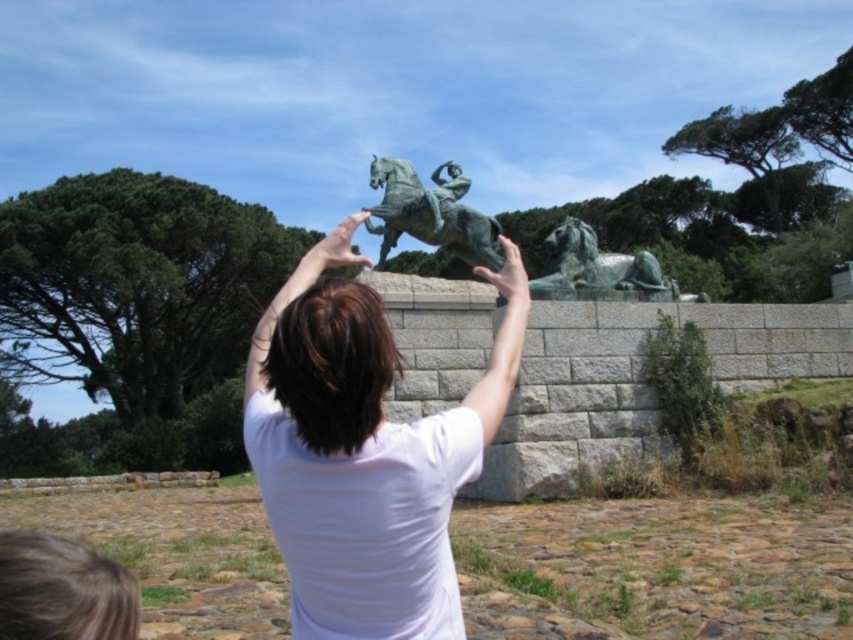
You are a photographer trying to capture the sculpture of the horse and the person in the same frame. Given that the white matte shirt at center is larger in size than the green polished stone horse at right, which object should you focus on first to ensure both are in the frame?

Since the white matte shirt at center is larger than the green polished stone horse at right, you should focus on the white matte shirt at center first to ensure both are in the frame, as it takes up more space and will require proper framing to include the smaller horse sculpture.

Based on the photo, you are a photographer planning to take a photo of the green polished bronze horseman at center and the green polished stone horse at right. You want both subjects to appear proportionally sized in your shot. Given their actual sizes, which subject should you move closer to the camera to achieve this?

The green polished bronze horseman at center is larger in size than the green polished stone horse at right. To make them appear proportionally sized in the photo, you should move closer to the smaller green polished stone horse at right while keeping the larger horseman at center at its current distance. This way, the smaller horse will appear larger in the frame, balancing their sizes.